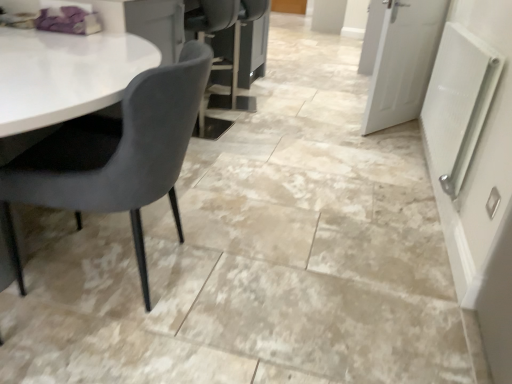
At what (x,y) coordinates should I click in order to perform the action: click on vacant region to the left of white matte door at upper right, the 1th door positioned from the front. Please return your answer as a coordinate pair (x, y). Looking at the image, I should click on (325, 123).